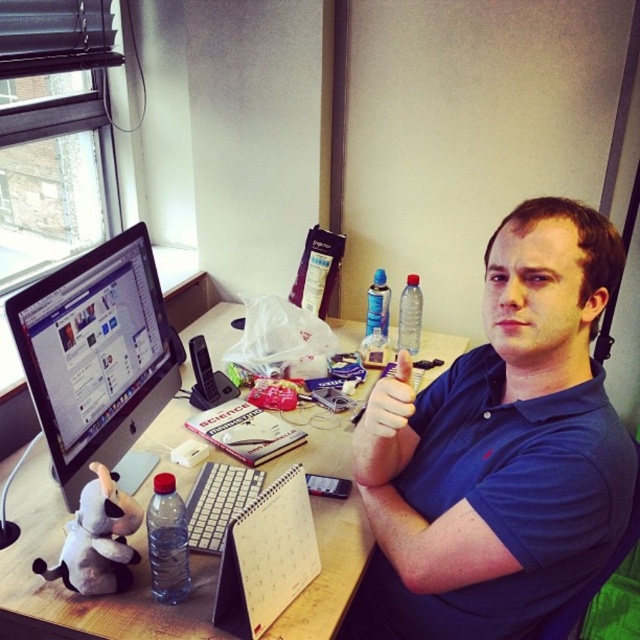
Does blue cotton shirt at center have a smaller size compared to blue plastic spray can at upper center?

Actually, blue cotton shirt at center might be larger than blue plastic spray can at upper center.

From the picture: Can you confirm if blue cotton shirt at center is thinner than blue plastic spray can at upper center?

No, blue cotton shirt at center is not thinner than blue plastic spray can at upper center.

I want to click on blue cotton shirt at center, so click(x=499, y=449).

Locate an element on the screen. This screenshot has width=640, height=640. blue cotton shirt at center is located at coordinates (499, 449).

Which is more to the right, blue cotton shirt at center or transparent plastic bottle at lower left?

From the viewer's perspective, blue cotton shirt at center appears more on the right side.

Can you confirm if blue cotton shirt at center is shorter than transparent plastic bottle at lower left?

In fact, blue cotton shirt at center may be taller than transparent plastic bottle at lower left.

This screenshot has width=640, height=640. Describe the element at coordinates (499, 449) in the screenshot. I see `blue cotton shirt at center` at that location.

I want to click on blue cotton shirt at center, so click(499, 449).

Between transparent plastic bottle at lower left and blue plastic spray can at upper center, which one appears on the right side from the viewer's perspective?

From the viewer's perspective, blue plastic spray can at upper center appears more on the right side.

Measure the distance between transparent plastic bottle at lower left and camera.

They are 3.41 feet apart.

This screenshot has height=640, width=640. In order to click on transparent plastic bottle at lower left in this screenshot , I will do `click(168, 541)`.